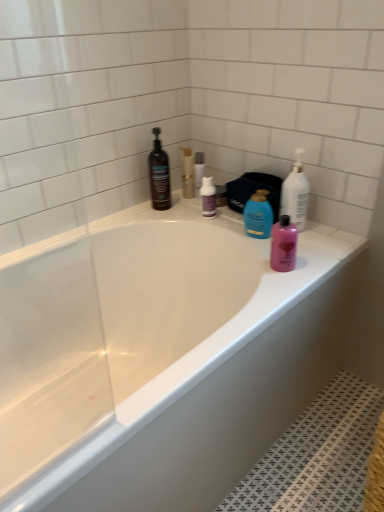
At what (x,y) coordinates should I click in order to perform the action: click on vacant area that lies between blue glossy bottle at upper center, the second cleaning product when ordered from right to left, and matte black bottle at upper left, which is the 1th cleaning product from left to right. Please return your answer as a coordinate pair (x, y). Looking at the image, I should click on [201, 222].